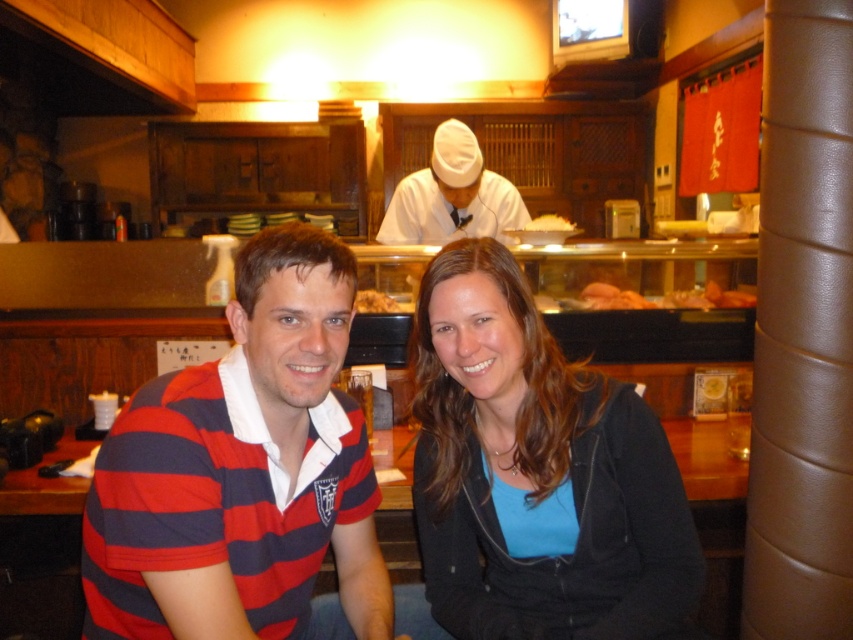
You are a customer sitting at the table in the sushi restaurant and want to point out the white matte chef hat at upper center and the yellowish matte sushi at center to your friend. Which one is located to the left of the other?

The white matte chef hat at upper center is to the left of the yellowish matte sushi at center.

You are standing in the sushi restaurant and want to find the blue matte shirt at center. According to the coordinates provided, where should you look in the image?

The blue matte shirt at center is located at the coordinates point (537, 474) in the image.